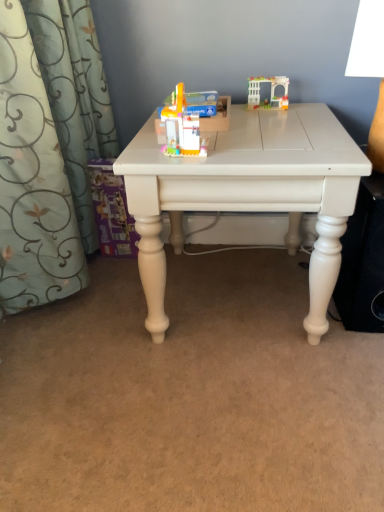
Question: In which direction should I rotate to look at translucent plastic toy at center, acting as the second toy starting from the top?

Choices:
 (A) right
 (B) left

Answer: (B)

Question: Could white matte table at center be considered to be inside white matte speaker at lower right?

Choices:
 (A) no
 (B) yes

Answer: (A)

Question: From a real-world perspective, is white matte speaker at lower right on top of white matte table at center?

Choices:
 (A) no
 (B) yes

Answer: (A)

Question: Are white matte speaker at lower right and white matte table at center making contact?

Choices:
 (A) no
 (B) yes

Answer: (A)

Question: Is white matte speaker at lower right turned away from white matte table at center?

Choices:
 (A) no
 (B) yes

Answer: (A)

Question: Is white matte speaker at lower right to the left of white matte table at center from the viewer's perspective?

Choices:
 (A) no
 (B) yes

Answer: (A)

Question: Is there a large distance between white matte speaker at lower right and white matte table at center?

Choices:
 (A) yes
 (B) no

Answer: (B)

Question: Considering the relative sizes of translucent plastic toy at center, acting as the second toy starting from the top, and translucent plastic archway at upper right, marked as the 1th toy in a right-to-left arrangement, in the image provided, is translucent plastic toy at center, acting as the second toy starting from the top, shorter than translucent plastic archway at upper right, marked as the 1th toy in a right-to-left arrangement,?

Choices:
 (A) no
 (B) yes

Answer: (A)

Question: Is translucent plastic toy at center, which is the second toy from back to front, taller than translucent plastic archway at upper right, which is the 2th toy in front-to-back order?

Choices:
 (A) no
 (B) yes

Answer: (B)

Question: Can we say translucent plastic toy at center, placed as the 1th toy when sorted from front to back, lies outside translucent plastic archway at upper right, the second toy when ordered from bottom to top?

Choices:
 (A) no
 (B) yes

Answer: (B)

Question: Can you confirm if translucent plastic toy at center, acting as the second toy starting from the top, is bigger than translucent plastic archway at upper right, which is the 2th toy in front-to-back order?

Choices:
 (A) yes
 (B) no

Answer: (A)

Question: Is translucent plastic toy at center, which appears as the 1th toy when ordered from the bottom, at the left side of translucent plastic archway at upper right, which is the 1th toy from top to bottom?

Choices:
 (A) no
 (B) yes

Answer: (B)

Question: Is the depth of translucent plastic toy at center, placed as the 1th toy when sorted from front to back, greater than that of translucent plastic archway at upper right, which is the 1th toy from top to bottom?

Choices:
 (A) no
 (B) yes

Answer: (A)

Question: From a real-world perspective, does white plastic lampshade at upper right sit lower than white matte table at center?

Choices:
 (A) yes
 (B) no

Answer: (B)